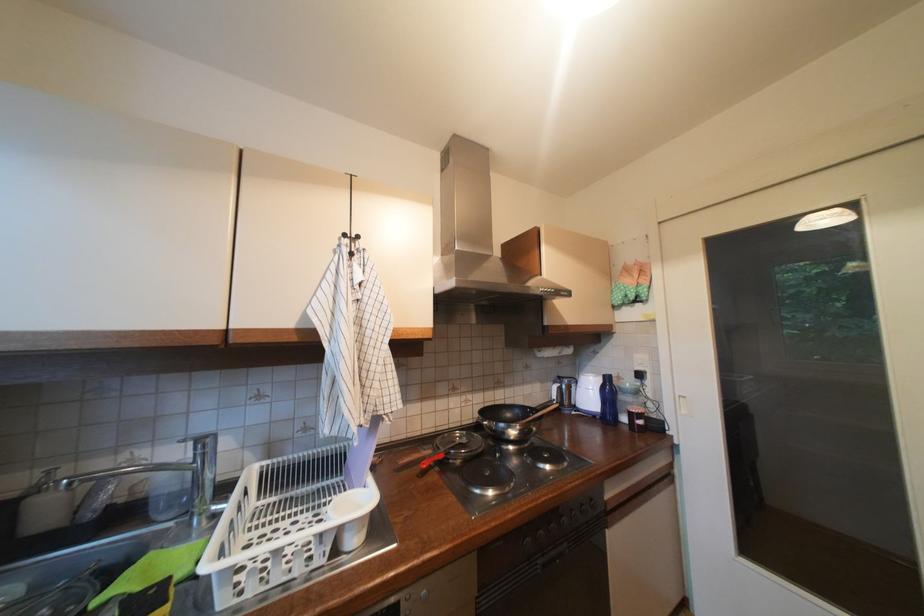
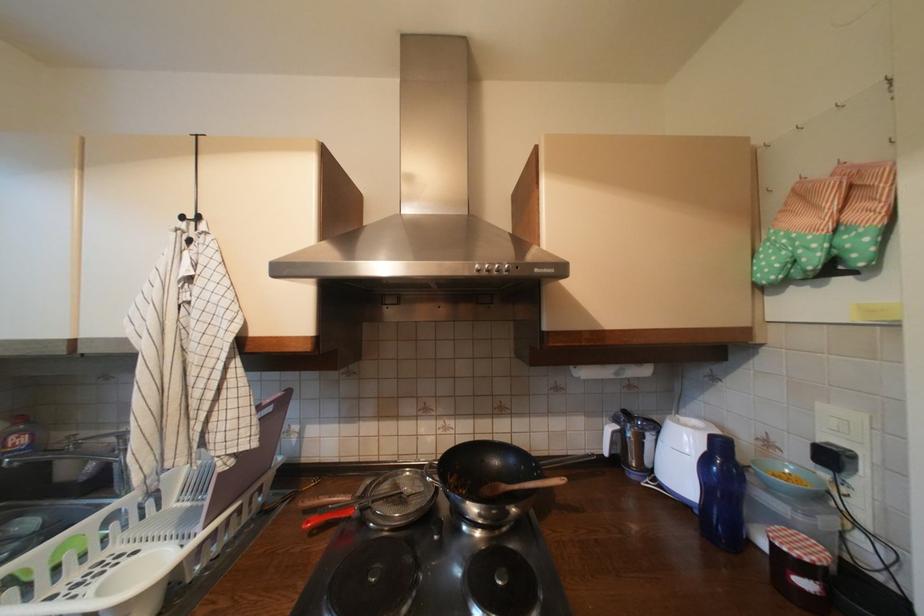
Locate, in the second image, the point that corresponds to point 648,376 in the first image.

(840, 459)